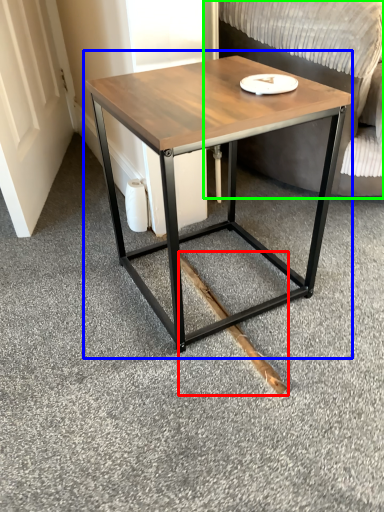
Question: Based on their relative distances, which object is farther from wood (highlighted by a red box)? Choose from coffee table (highlighted by a blue box) and swivel chair (highlighted by a green box).

Choices:
 (A) coffee table
 (B) swivel chair

Answer: (B)